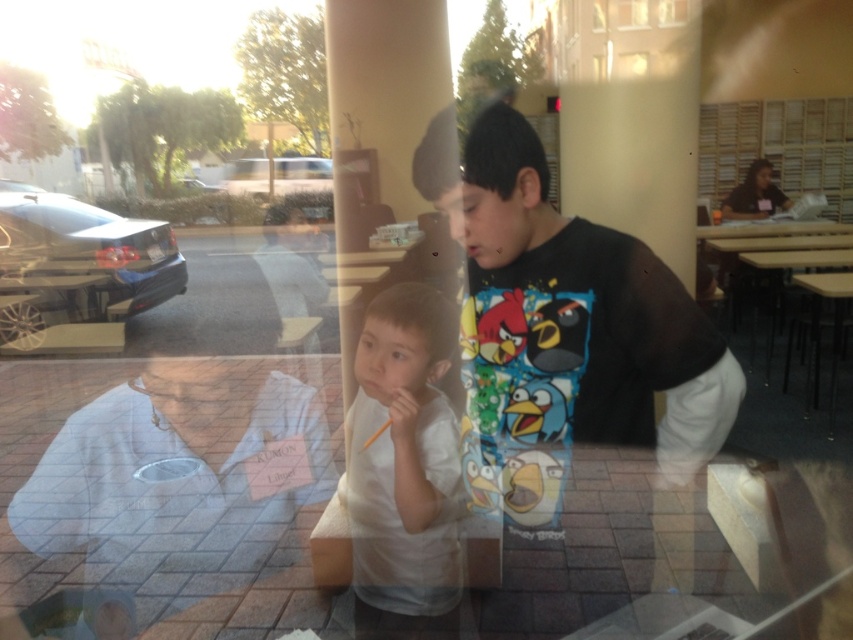
Can you confirm if white fabric at left is smaller than white matte shirt at center?

No, white fabric at left is not smaller than white matte shirt at center.

Is point (303, 390) farther from camera compared to point (366, 337)?

Yes, point (303, 390) is behind point (366, 337).

Who is more forward, (206, 605) or (432, 416)?

Positioned in front is point (432, 416).

I want to click on white fabric at left, so click(164, 492).